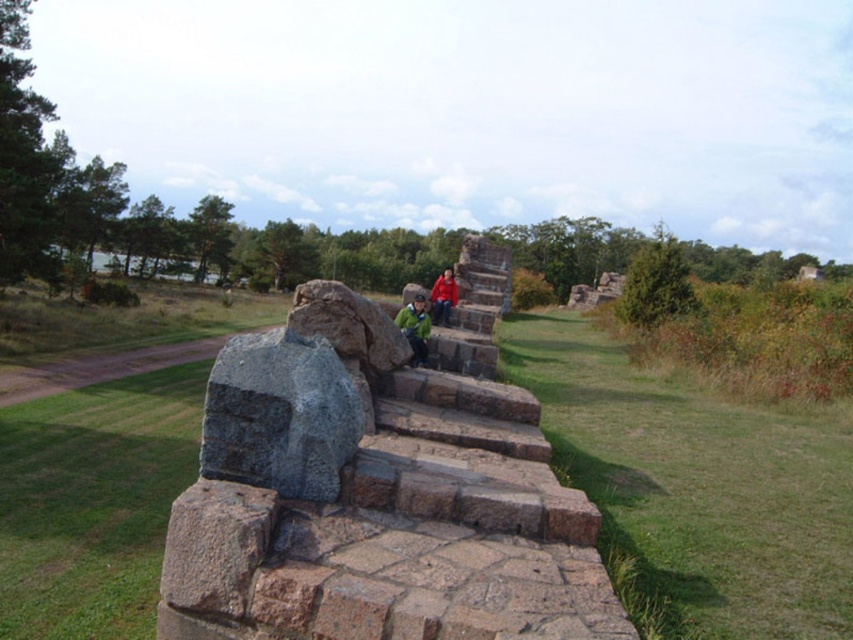
Does gray stone steps at center appear under red fabric jacket at center?

Indeed, gray stone steps at center is positioned under red fabric jacket at center.

Is gray stone steps at center further to the viewer compared to red fabric jacket at center?

No, gray stone steps at center is closer to the viewer.

Which is in front, point (225, 355) or point (445, 288)?

Point (225, 355) is in front.

At what (x,y) coordinates should I click in order to perform the action: click on gray stone steps at center. Please return your answer as a coordinate pair (x, y). This screenshot has height=640, width=853. Looking at the image, I should click on (374, 499).

Is gray stone steps at center thinner than green matte jacket at center?

In fact, gray stone steps at center might be wider than green matte jacket at center.

Between point (292, 628) and point (409, 339), which one is positioned behind?

Point (409, 339)

At what (x,y) coordinates should I click in order to perform the action: click on gray stone steps at center. Please return your answer as a coordinate pair (x, y). The image size is (853, 640). Looking at the image, I should click on click(374, 499).

Is green matte jacket at center thinner than red fabric jacket at center?

Correct, green matte jacket at center's width is less than red fabric jacket at center's.

Between green matte jacket at center and red fabric jacket at center, which one has more height?

Standing taller between the two is red fabric jacket at center.

Which is behind, point (407, 314) or point (448, 305)?

Positioned behind is point (448, 305).

Identify the location of green matte jacket at center. This screenshot has height=640, width=853. (415, 326).